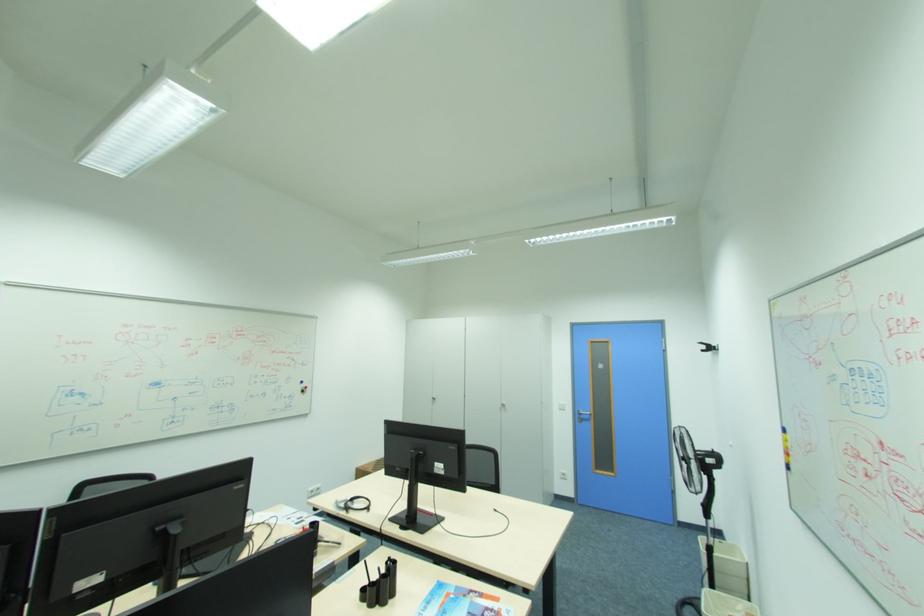
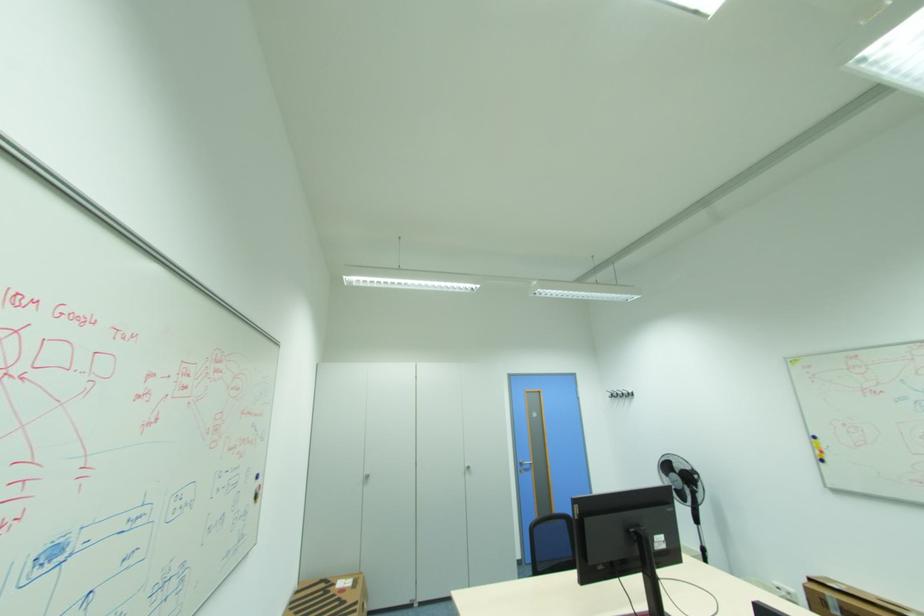
In the second image, find the point that corresponds to (588,416) in the first image.

(529, 467)